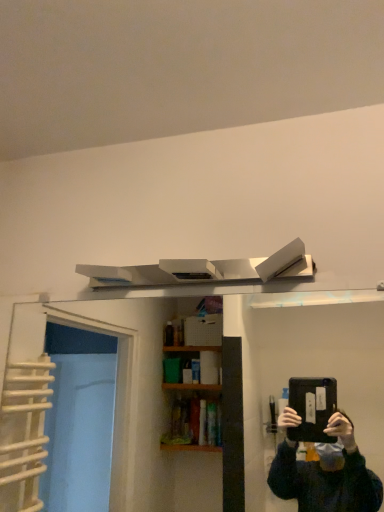
What do you see at coordinates (127, 396) in the screenshot? I see `matte black mirror at upper center` at bounding box center [127, 396].

Image resolution: width=384 pixels, height=512 pixels. I want to click on matte black mirror at upper center, so tap(127, 396).

At what (x,y) coordinates should I click in order to perform the action: click on matte black mirror at upper center. Please return your answer as a coordinate pair (x, y). Looking at the image, I should click on (127, 396).